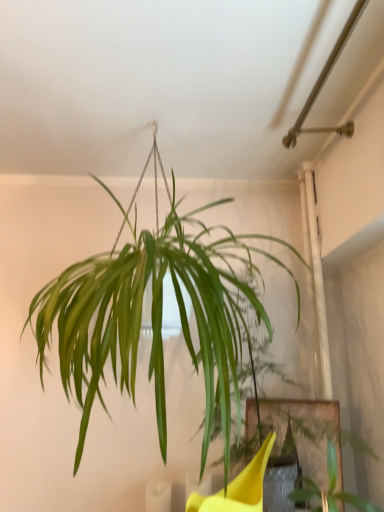
Question: Is green leafy plant at lower right a part of green leafy plant at center?

Choices:
 (A) yes
 (B) no

Answer: (B)

Question: Does green leafy plant at center have a larger size compared to green leafy plant at lower right?

Choices:
 (A) no
 (B) yes

Answer: (B)

Question: Considering the relative sizes of green leafy plant at center and green leafy plant at lower right in the image provided, is green leafy plant at center thinner than green leafy plant at lower right?

Choices:
 (A) no
 (B) yes

Answer: (A)

Question: Is green leafy plant at center outside of green leafy plant at lower right?

Choices:
 (A) no
 (B) yes

Answer: (B)

Question: Does green leafy plant at center appear on the right side of green leafy plant at lower right?

Choices:
 (A) yes
 (B) no

Answer: (B)

Question: Is green leafy plant at center facing towards green leafy plant at lower right?

Choices:
 (A) no
 (B) yes

Answer: (A)

Question: From a real-world perspective, is green leafy plant at lower right physically above green leafy plant at center?

Choices:
 (A) no
 (B) yes

Answer: (A)

Question: Does green leafy plant at lower right have a smaller size compared to green leafy plant at center?

Choices:
 (A) yes
 (B) no

Answer: (A)

Question: From a real-world perspective, does green leafy plant at lower right sit lower than green leafy plant at center?

Choices:
 (A) no
 (B) yes

Answer: (B)

Question: Can you confirm if green leafy plant at lower right is shorter than green leafy plant at center?

Choices:
 (A) yes
 (B) no

Answer: (A)

Question: Does green leafy plant at lower right have a larger size compared to green leafy plant at center?

Choices:
 (A) no
 (B) yes

Answer: (A)

Question: Would you say green leafy plant at lower right is outside green leafy plant at center?

Choices:
 (A) no
 (B) yes

Answer: (B)

Question: Considering the positions of green leafy plant at center and green leafy plant at lower right in the image, is green leafy plant at center wider or thinner than green leafy plant at lower right?

Choices:
 (A) wide
 (B) thin

Answer: (A)